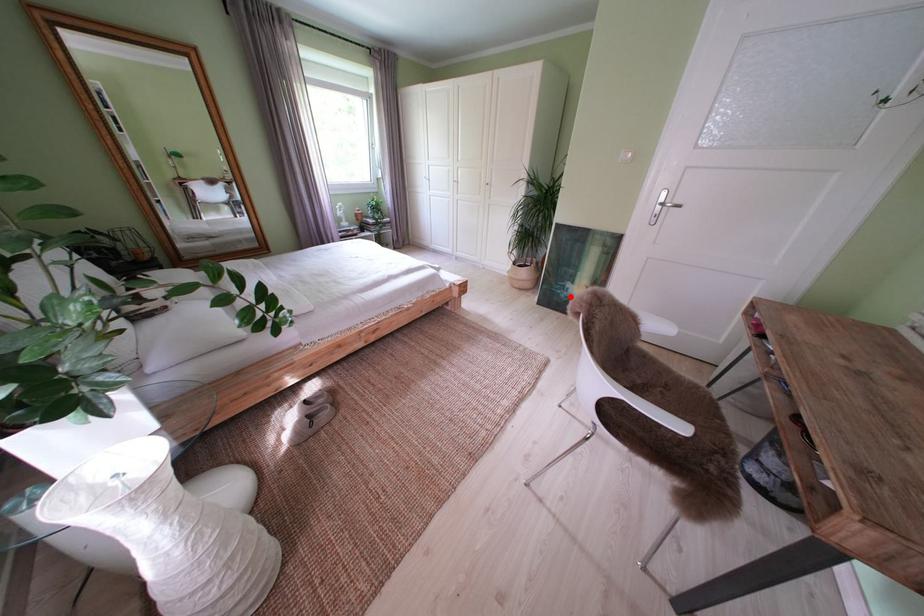
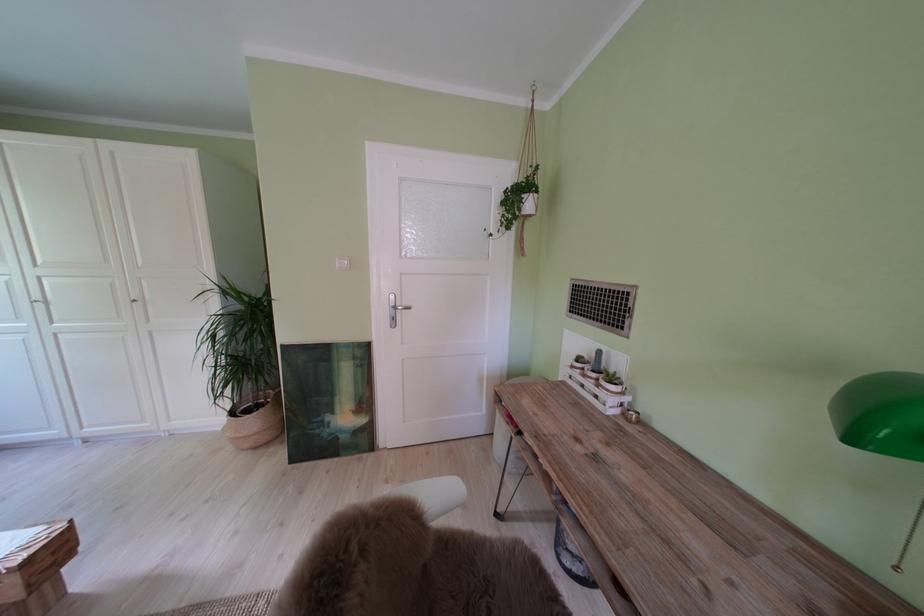
In the second image, find the point that corresponds to the highlighted location in the first image.

(329, 437)